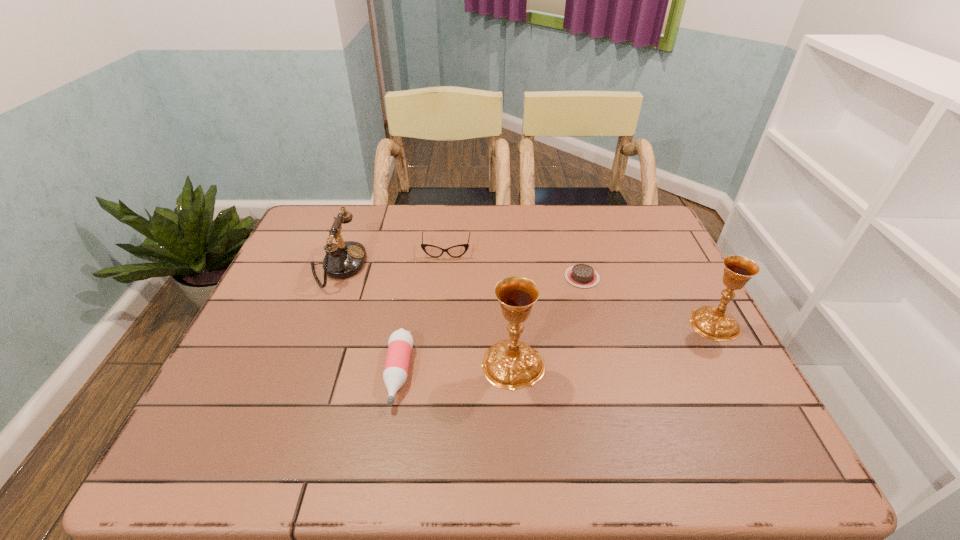
Where is `vacant spot to place a chalice on the left`? vacant spot to place a chalice on the left is located at coordinates (270, 414).